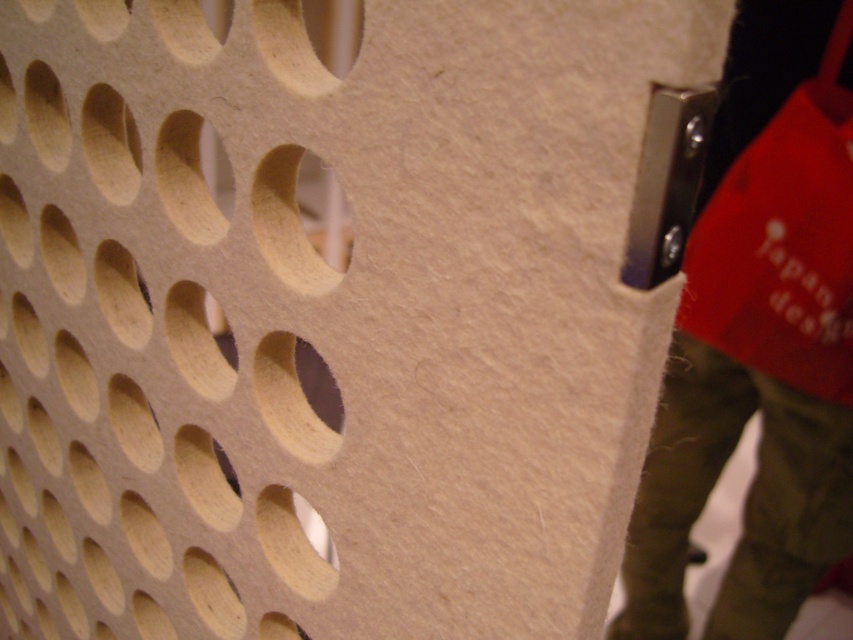
Between matte red fabric at right and light brown wood hole at center, which one has less height?

light brown wood hole at center is shorter.

Can you confirm if matte red fabric at right is wider than light brown wood hole at center?

Correct, the width of matte red fabric at right exceeds that of light brown wood hole at center.

The image size is (853, 640). In order to click on matte red fabric at right in this screenshot , I will do `click(752, 483)`.

Does matte red fabric at right have a larger size compared to matte wood hole at center?

Correct, matte red fabric at right is larger in size than matte wood hole at center.

Is matte red fabric at right positioned behind matte wood hole at center?

Yes, it is.

Is point (798, 413) closer to camera compared to point (287, 541)?

No, (798, 413) is further to viewer.

Identify the location of matte red fabric at right. Image resolution: width=853 pixels, height=640 pixels. [752, 483].

Can you confirm if light brown cardboard hole at center is positioned to the right of light wood/rough hole at center-left?

Incorrect, light brown cardboard hole at center is not on the right side of light wood/rough hole at center-left.

Is light brown cardboard hole at center behind light wood/rough hole at center-left?

Yes, it is.

This screenshot has height=640, width=853. In order to click on light brown cardboard hole at center in this screenshot , I will do `click(293, 397)`.